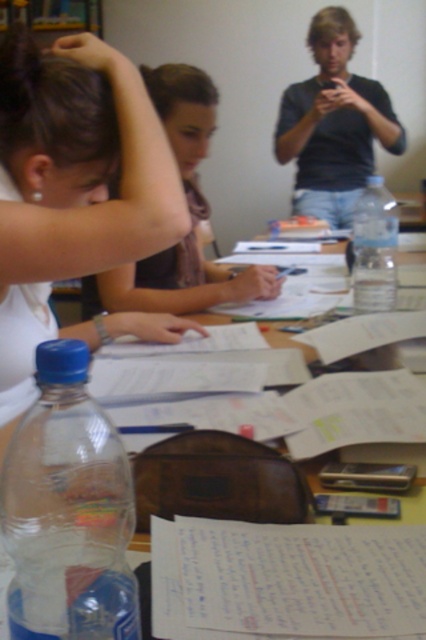
Question: Which object is the farthest from the clear plastic bottle at center?

Choices:
 (A) white paper at center
 (B) transparent plastic table at center

Answer: (B)

Question: Can you confirm if matte black hair at upper left is wider than matte brown hair at center?

Choices:
 (A) yes
 (B) no

Answer: (B)

Question: Is white paper at center bigger than matte brown hair at center?

Choices:
 (A) no
 (B) yes

Answer: (A)

Question: Is matte black hair at upper left closer to the viewer compared to brown hair at upper left?

Choices:
 (A) yes
 (B) no

Answer: (A)

Question: Among these points, which one is farthest from the camera?

Choices:
 (A) (347, 52)
 (B) (340, 227)

Answer: (B)

Question: Based on their relative distances, which object is farther from the clear plastic bottle at center?

Choices:
 (A) white paper at center
 (B) brown hair at upper left

Answer: (B)